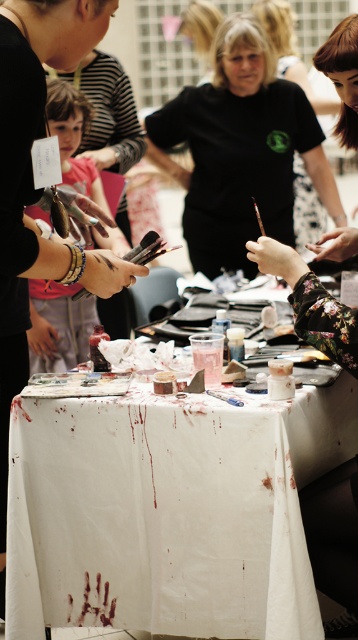
Who is shorter, black matte t-shirt at center or matte black shirt at center?

black matte t-shirt at center

Between point (292, 106) and point (36, 51), which one is positioned in front?

Point (36, 51) is more forward.

Identify the location of black matte t-shirt at center. Image resolution: width=358 pixels, height=640 pixels. (240, 150).

Between white cloth at center and black matte t-shirt at center, which one has less height?

Standing shorter between the two is white cloth at center.

Can you confirm if white cloth at center is positioned below black matte t-shirt at center?

Indeed, white cloth at center is positioned under black matte t-shirt at center.

Describe the element at coordinates (168, 509) in the screenshot. I see `white cloth at center` at that location.

At what (x,y) coordinates should I click in order to perform the action: click on white cloth at center. Please return your answer as a coordinate pair (x, y). This screenshot has width=358, height=640. Looking at the image, I should click on (168, 509).

Is white cloth at center positioned in front of matte black shirt at center?

No, white cloth at center is further to the viewer.

Can you confirm if white cloth at center is positioned to the right of matte black shirt at center?

Yes, white cloth at center is to the right of matte black shirt at center.

The image size is (358, 640). Describe the element at coordinates (168, 509) in the screenshot. I see `white cloth at center` at that location.

Find the location of a particular element. white cloth at center is located at coordinates (168, 509).